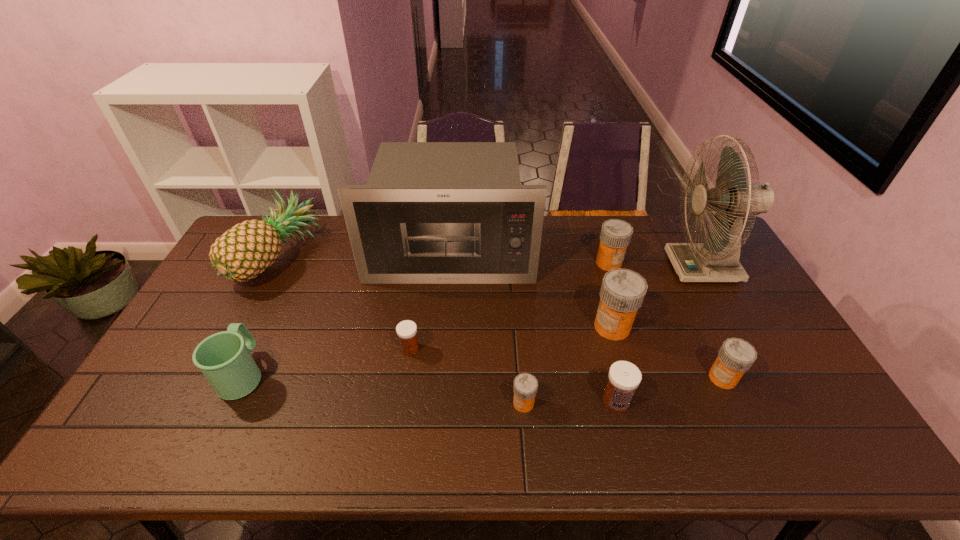
The image size is (960, 540). Find the location of `vacant region located on the front-facing side of the fan`. vacant region located on the front-facing side of the fan is located at coordinates (600, 267).

You are a GUI agent. You are given a task and a screenshot of the screen. Output one action in this format:
    pyautogui.click(x=<x>, y=<y>)
    Task: Click on the blank space located on the front-facing side of the gray microwave oven
    
    Given the screenshot: What is the action you would take?
    pyautogui.click(x=447, y=301)

Where is `vacant region located on the right of the pineapple`? The image size is (960, 540). vacant region located on the right of the pineapple is located at coordinates (372, 257).

At what (x,y) coordinates should I click in order to perform the action: click on free region located on the label side of the biggest orange medicine. Please return your answer as a coordinate pair (x, y). The width and height of the screenshot is (960, 540). Looking at the image, I should click on (563, 327).

I want to click on vacant space situated 0.150m on the label side of the biggest orange medicine, so click(x=542, y=327).

Where is `free space located 0.110m on the label side of the biggest orange medicine`? This screenshot has width=960, height=540. free space located 0.110m on the label side of the biggest orange medicine is located at coordinates (556, 327).

At what (x,y) coordinates should I click in order to perform the action: click on vacant space located 0.270m on the label side of the farthest orange medicine. Please return your answer as a coordinate pair (x, y). Looking at the image, I should click on (632, 334).

The image size is (960, 540). Find the location of `vacant space located 0.060m on the side of the mug with the handle`. vacant space located 0.060m on the side of the mug with the handle is located at coordinates (263, 332).

Locate an element on the screen. vacant area located 0.250m on the side of the mug with the handle is located at coordinates (284, 287).

The height and width of the screenshot is (540, 960). In order to click on vacant space situated 0.290m on the side of the mug with the handle in this screenshot , I will do `click(288, 279)`.